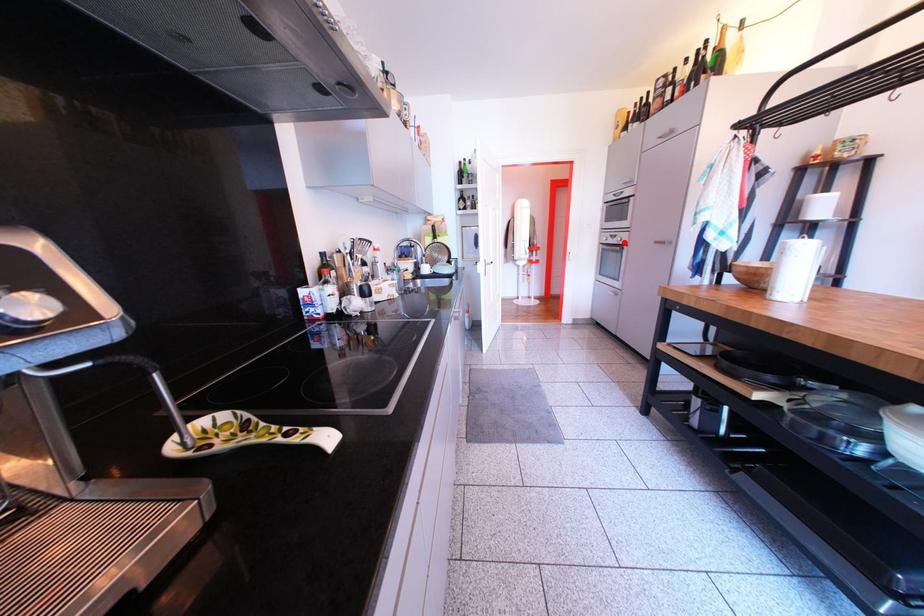
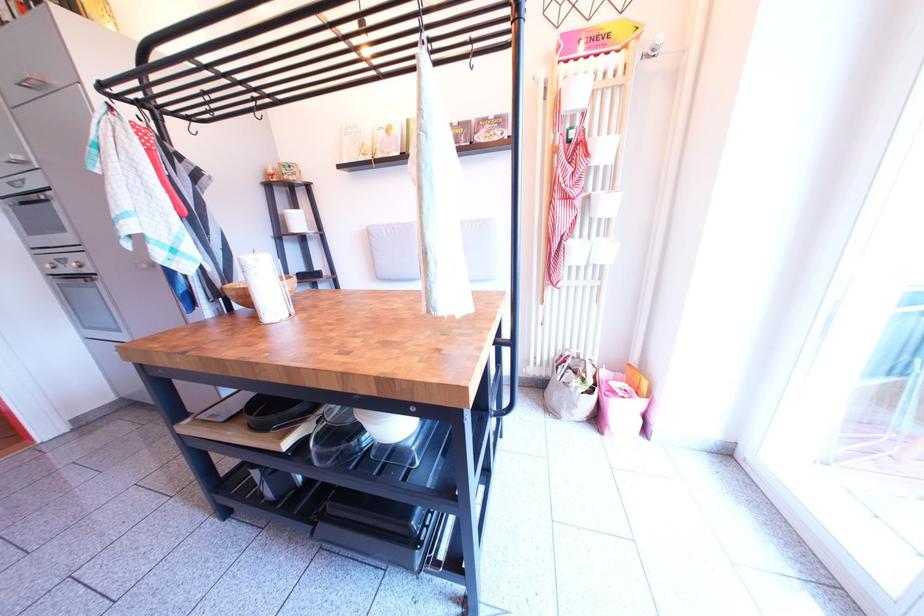
The point at the highlighted location is marked in the first image. Where is the corresponding point in the second image?

(74, 267)